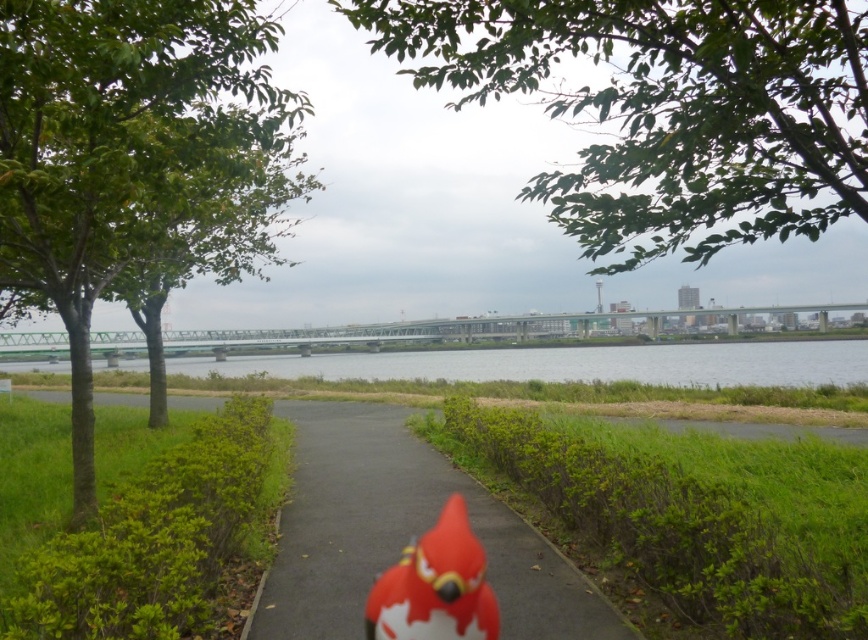
Question: Which point is farther to the camera?

Choices:
 (A) green leafy tree at upper center
 (B) smooth asphalt path at center
 (C) matte red plush bird at center
 (D) clear water at center

Answer: (D)

Question: Which of the following is the closest to the observer?

Choices:
 (A) smooth asphalt path at center
 (B) green leafy tree at upper center
 (C) green leafy tree at left
 (D) clear water at center

Answer: (B)

Question: Is green leafy tree at upper center smaller than clear water at center?

Choices:
 (A) yes
 (B) no

Answer: (B)

Question: Which of the following is the farthest from the observer?

Choices:
 (A) green leafy tree at left
 (B) green leafy tree at upper center

Answer: (A)

Question: Is clear water at center smaller than matte red plush bird at center?

Choices:
 (A) no
 (B) yes

Answer: (A)

Question: Does green leafy tree at left appear on the left side of matte red plush bird at center?

Choices:
 (A) no
 (B) yes

Answer: (B)